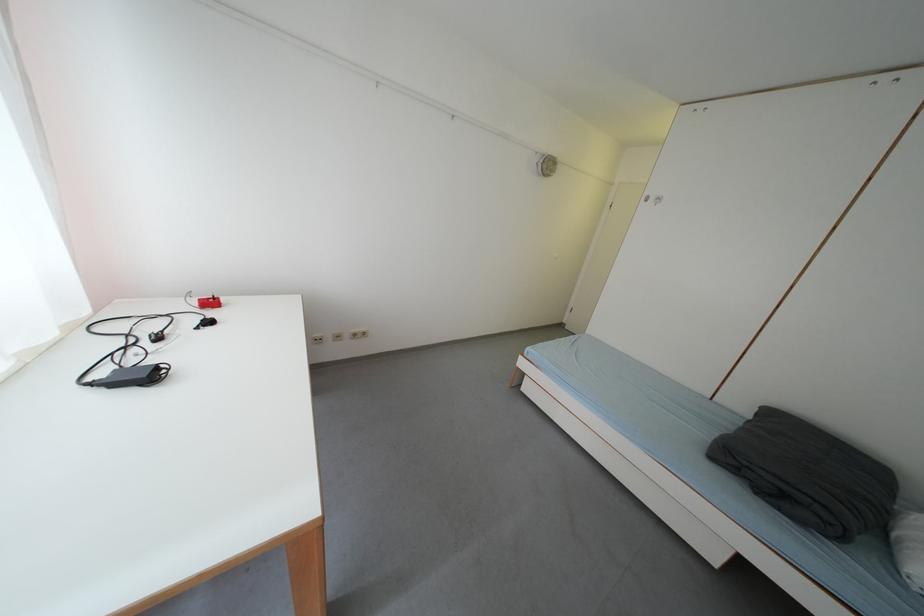
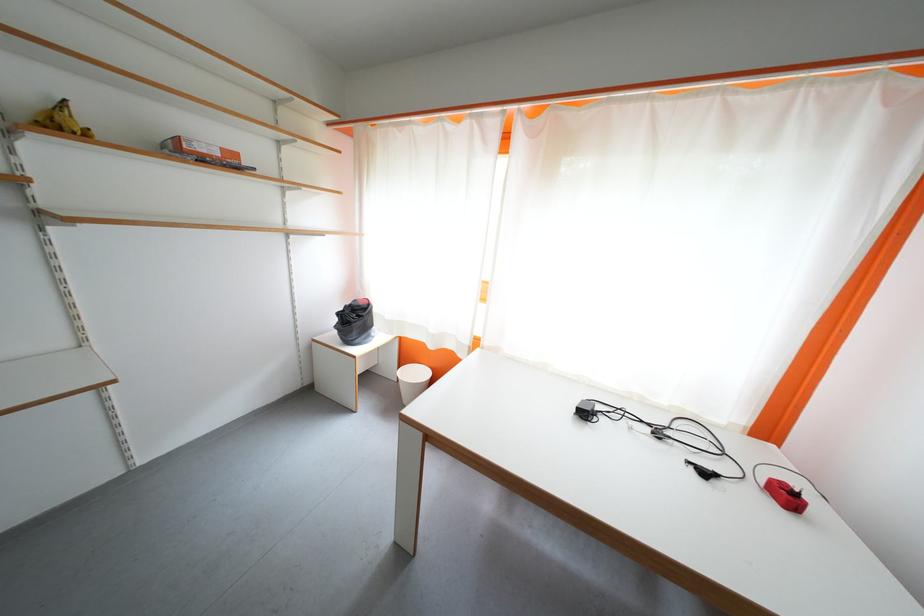
In the second image, find the point that corresponds to (x=219, y=326) in the first image.

(713, 477)